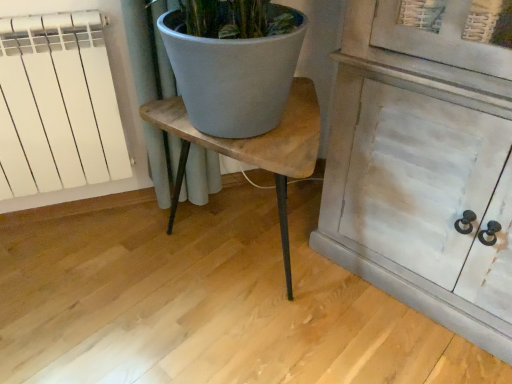
This screenshot has width=512, height=384. What do you see at coordinates (253, 148) in the screenshot? I see `wooden table at center` at bounding box center [253, 148].

At what (x,y) coordinates should I click in order to perform the action: click on wooden table at center. Please return your answer as a coordinate pair (x, y). The width and height of the screenshot is (512, 384). Looking at the image, I should click on (253, 148).

Describe the element at coordinates (57, 105) in the screenshot. I see `white matte radiator at left` at that location.

The width and height of the screenshot is (512, 384). What are the coordinates of `white matte radiator at left` in the screenshot? It's located at coord(57,105).

This screenshot has width=512, height=384. Identify the location of wooden table at center. (253, 148).

Does white matte radiator at left appear on the left side of wooden table at center?

Correct, you'll find white matte radiator at left to the left of wooden table at center.

Relative to wooden table at center, is white matte radiator at left in front or behind?

white matte radiator at left is positioned farther from the viewer than wooden table at center.

Which is further, (58, 187) or (297, 172)?

The point (58, 187) is more distant.

From the image's perspective, which object appears higher, white matte radiator at left or wooden table at center?

white matte radiator at left is shown above in the image.

From the picture: From a real-world perspective, does white matte radiator at left sit lower than wooden table at center?

Incorrect, from a real-world perspective, white matte radiator at left is higher than wooden table at center.

Considering the sizes of objects white matte radiator at left and wooden table at center in the image provided, who is wider, white matte radiator at left or wooden table at center?

Wider between the two is wooden table at center.

Is white matte radiator at left taller or shorter than wooden table at center?

In the image, white matte radiator at left appears to be taller than wooden table at center.

Which of these two, white matte radiator at left or wooden table at center, is bigger?

Bigger between the two is wooden table at center.

Is white matte radiator at left located outside wooden table at center?

Yes, white matte radiator at left is not within wooden table at center.

Can you see white matte radiator at left touching wooden table at center?

No.

Is white matte radiator at left facing towards wooden table at center?

No, white matte radiator at left is not oriented towards wooden table at center.

Where is `radiator located above the wooden table at center (from a real-world perspective)`? The width and height of the screenshot is (512, 384). radiator located above the wooden table at center (from a real-world perspective) is located at coordinates (57, 105).

Between wooden table at center and white matte radiator at left, which one appears on the right side from the viewer's perspective?

From the viewer's perspective, wooden table at center appears more on the right side.

Which is in front, wooden table at center or white matte radiator at left?

wooden table at center is more forward.

Is point (249, 150) closer or farther from the camera than point (42, 111)?

Point (249, 150).

From the image's perspective, is wooden table at center under white matte radiator at left?

Correct, wooden table at center appears lower than white matte radiator at left in the image.

From a real-world perspective, who is located higher, wooden table at center or white matte radiator at left?

In real-world perspective, white matte radiator at left is above.

Does wooden table at center have a greater width compared to white matte radiator at left?

Indeed, wooden table at center has a greater width compared to white matte radiator at left.

Who is shorter, wooden table at center or white matte radiator at left?

Standing shorter between the two is wooden table at center.

Who is bigger, wooden table at center or white matte radiator at left?

Bigger between the two is wooden table at center.

Would you say wooden table at center is inside or outside white matte radiator at left?

wooden table at center is not inside white matte radiator at left, it's outside.

Is wooden table at center touching white matte radiator at left?

They are not placed beside each other.

Could you tell me if wooden table at center is facing white matte radiator at left?

No, wooden table at center is not oriented towards white matte radiator at left.

How different are the orientations of wooden table at center and white matte radiator at left in degrees?

There is a 9.5-degree angle between the facing directions of wooden table at center and white matte radiator at left.

The height and width of the screenshot is (384, 512). In order to click on table on the right of white matte radiator at left in this screenshot , I will do `click(253, 148)`.

Where is `table lying below the white matte radiator at left (from the image's perspective)`? Image resolution: width=512 pixels, height=384 pixels. table lying below the white matte radiator at left (from the image's perspective) is located at coordinates (253, 148).

In the image, there is a wooden table at center. Where is `radiator above it (from the image's perspective)`? The height and width of the screenshot is (384, 512). radiator above it (from the image's perspective) is located at coordinates (57, 105).